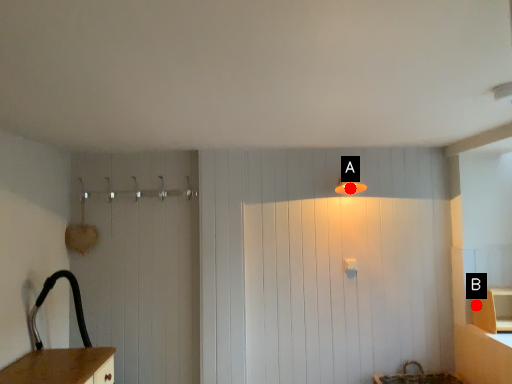
Question: Two points are circled on the image, labeled by A and B beside each circle. Which of the following is the farthest from the observer?

Choices:
 (A) A is further
 (B) B is further

Answer: (A)